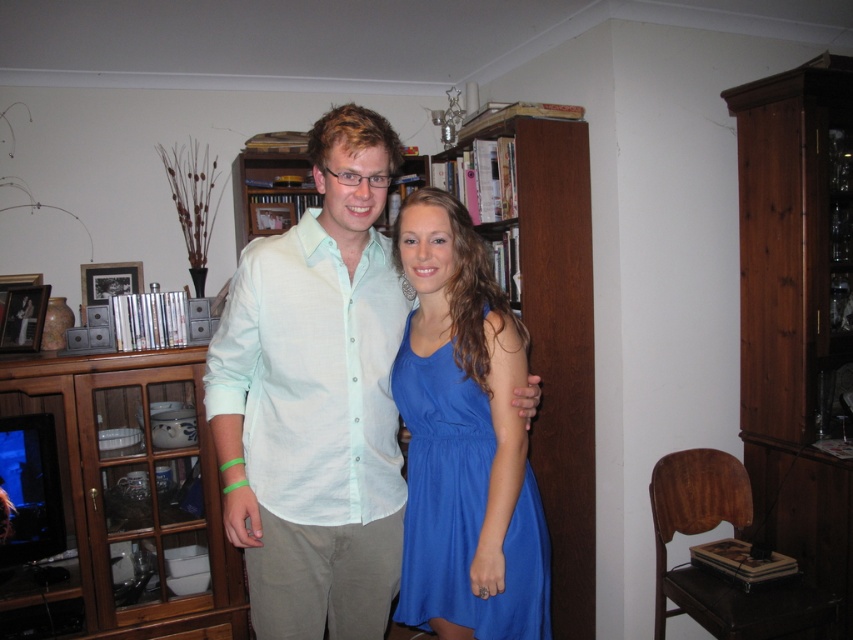
What do you see at coordinates (134, 490) in the screenshot? The height and width of the screenshot is (640, 853). I see `wooden cabinet at left` at bounding box center [134, 490].

Does wooden cabinet at left appear over wooden bookshelf at center?

Incorrect, wooden cabinet at left is not positioned above wooden bookshelf at center.

Is point (138, 611) more distant than point (590, 428)?

No, (138, 611) is in front of (590, 428).

You are a GUI agent. You are given a task and a screenshot of the screen. Output one action in this format:
    pyautogui.click(x=<x>, y=<y>)
    Task: Click on the wooden cabinet at left
    The height and width of the screenshot is (640, 853).
    Given the screenshot: What is the action you would take?
    pyautogui.click(x=134, y=490)

This screenshot has width=853, height=640. Describe the element at coordinates (316, 397) in the screenshot. I see `light green cotton shirt at center` at that location.

Who is more distant from viewer, (234, 429) or (434, 403)?

The point (434, 403) is more distant.

What do you see at coordinates (316, 397) in the screenshot? The width and height of the screenshot is (853, 640). I see `light green cotton shirt at center` at bounding box center [316, 397].

Where is `light green cotton shirt at center`? The height and width of the screenshot is (640, 853). light green cotton shirt at center is located at coordinates (316, 397).

Does wooden bookshelf at center have a greater height compared to blue satin dress at center?

Yes.

Is wooden bookshelf at center to the right of blue satin dress at center from the viewer's perspective?

Yes, wooden bookshelf at center is to the right of blue satin dress at center.

The width and height of the screenshot is (853, 640). What do you see at coordinates (549, 323) in the screenshot?
I see `wooden bookshelf at center` at bounding box center [549, 323].

Locate an element on the screen. The image size is (853, 640). wooden bookshelf at center is located at coordinates (549, 323).